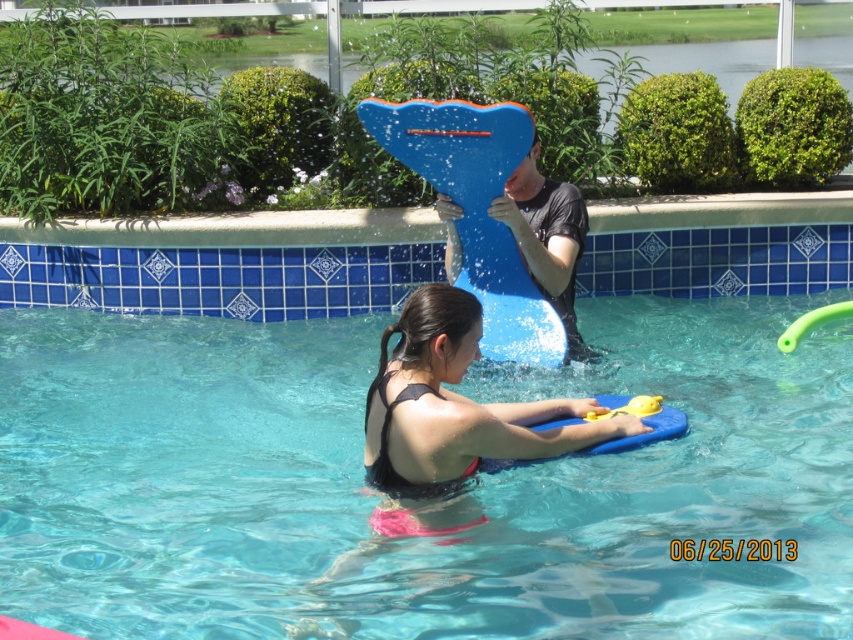
Question: Is blue glossy pool at center further to the viewer compared to blue matte surfboard at center?

Choices:
 (A) yes
 (B) no

Answer: (B)

Question: Which point appears farthest from the camera in this image?

Choices:
 (A) (531, 444)
 (B) (544, 275)

Answer: (B)

Question: Is matte black swimsuit at center to the left of blue matte surfboard at center from the viewer's perspective?

Choices:
 (A) yes
 (B) no

Answer: (A)

Question: Does blue glossy pool at center appear under matte black swimsuit at center?

Choices:
 (A) no
 (B) yes

Answer: (B)

Question: Among these objects, which one is nearest to the camera?

Choices:
 (A) blue glossy pool at center
 (B) blue matte surfboard at center

Answer: (A)

Question: Which of these objects is positioned closest to the matte black swimsuit at center?

Choices:
 (A) blue glossy pool at center
 (B) blue matte surfboard at center

Answer: (A)